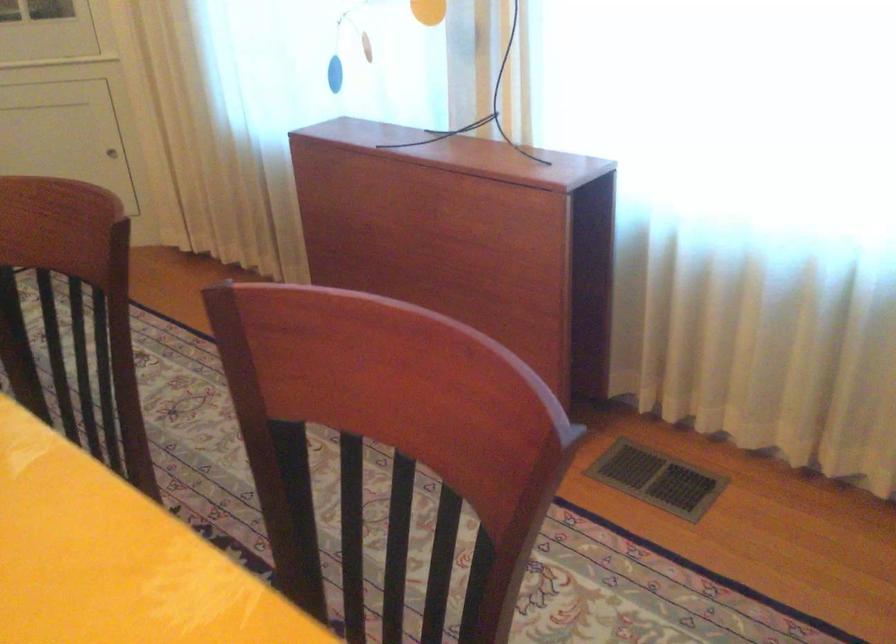
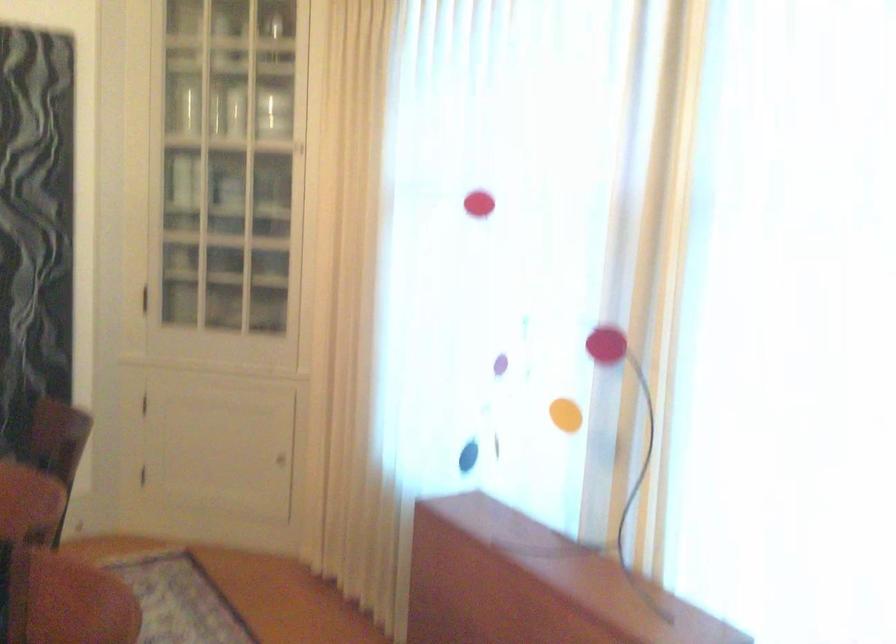
The point at (109, 156) is marked in the first image. Where is the corresponding point in the second image?

(280, 460)